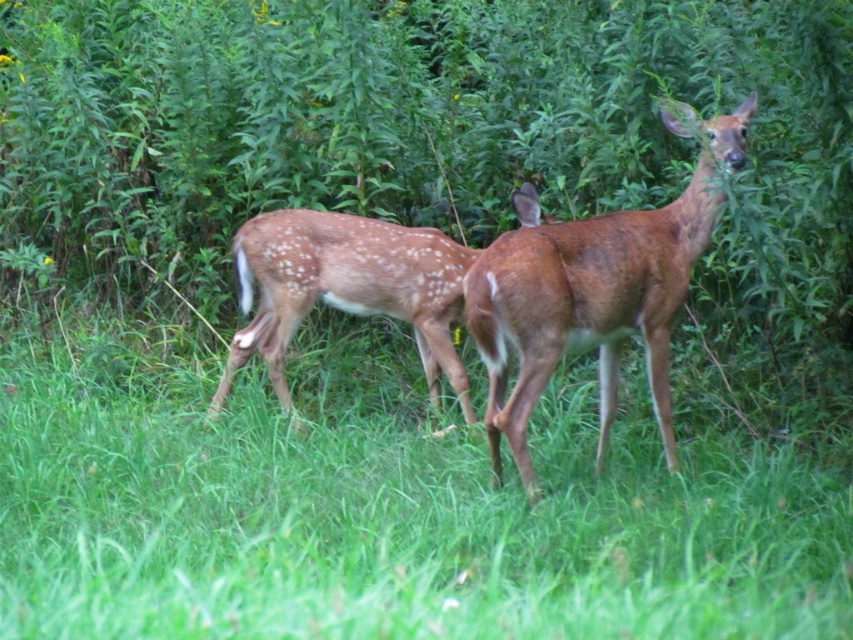
Question: Is green grass at center to the left of brown speckled fur at center from the viewer's perspective?

Choices:
 (A) yes
 (B) no

Answer: (A)

Question: Can you confirm if green grass at center is thinner than brown matte/deer at center?

Choices:
 (A) yes
 (B) no

Answer: (B)

Question: Where is brown matte/deer at center located in relation to brown speckled fur at center in the image?

Choices:
 (A) below
 (B) above

Answer: (B)

Question: Which of the following is the farthest from the observer?

Choices:
 (A) (659, 268)
 (B) (387, 598)
 (C) (334, 227)

Answer: (C)

Question: Which object is farther from the camera taking this photo?

Choices:
 (A) brown speckled fur at center
 (B) brown matte/deer at center

Answer: (A)

Question: Which of the following is the farthest from the observer?

Choices:
 (A) brown speckled fur at center
 (B) brown matte/deer at center
 (C) green grass at center

Answer: (A)